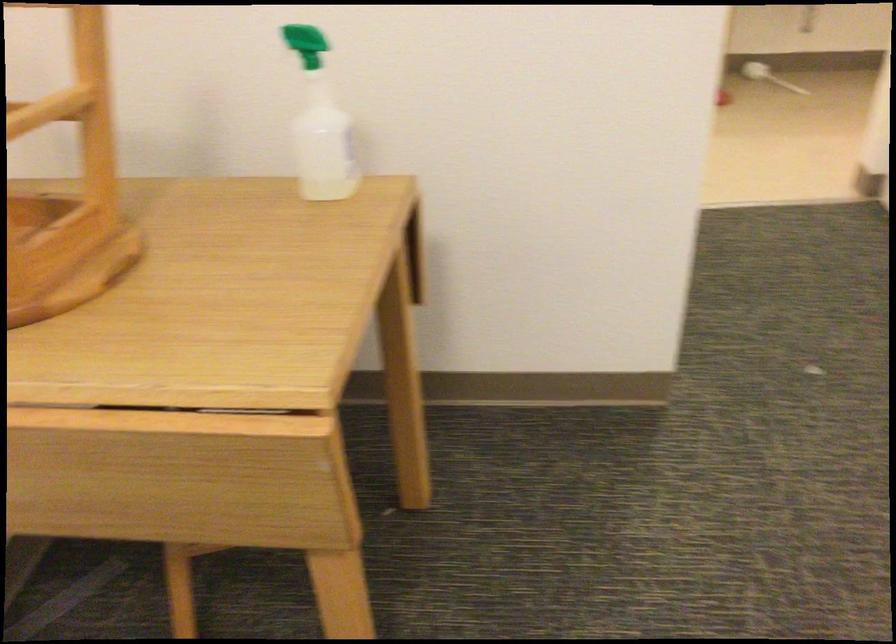
The image size is (896, 644). What do you see at coordinates (304, 39) in the screenshot?
I see `the green bottle trigger` at bounding box center [304, 39].